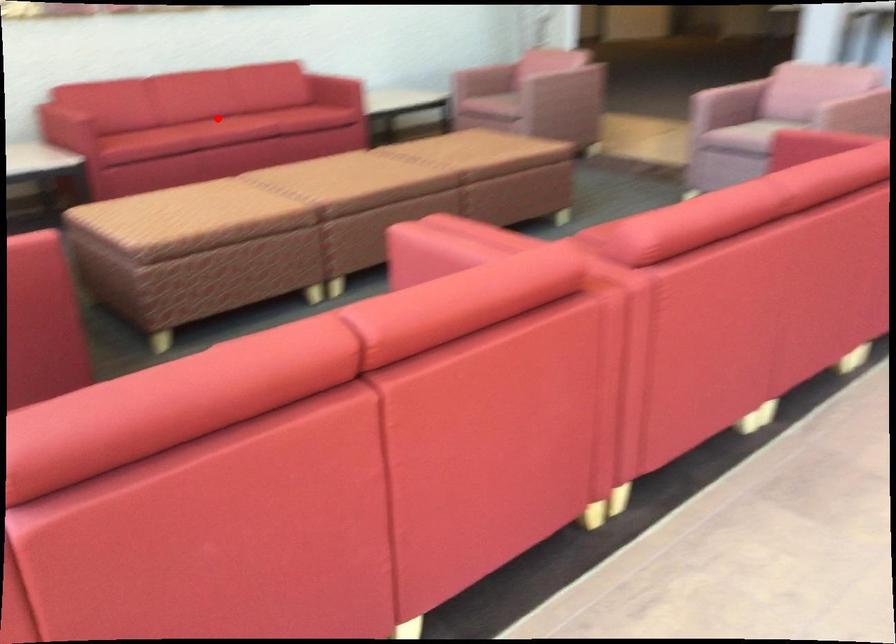
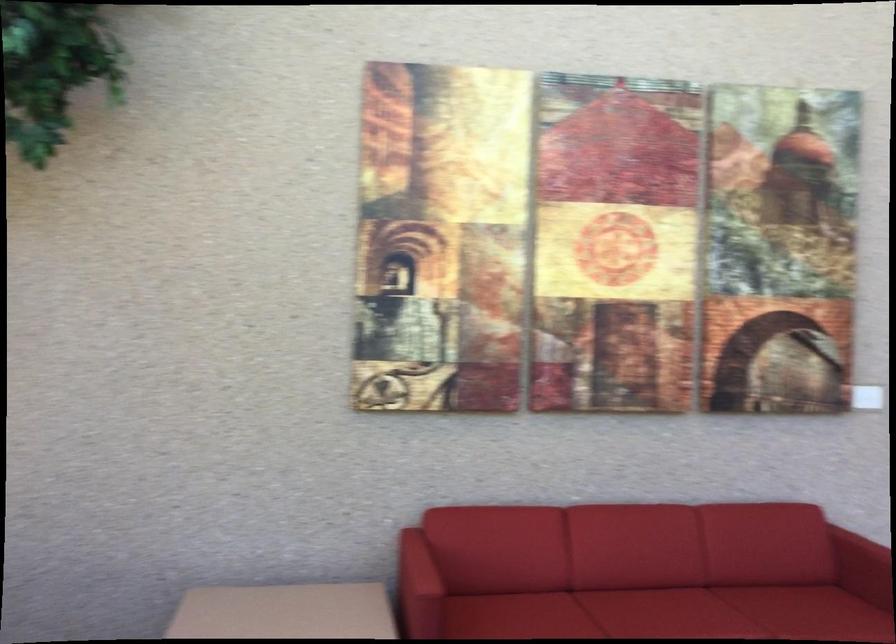
In the second image, find the point that corresponds to the highlighted location in the first image.

(659, 607)